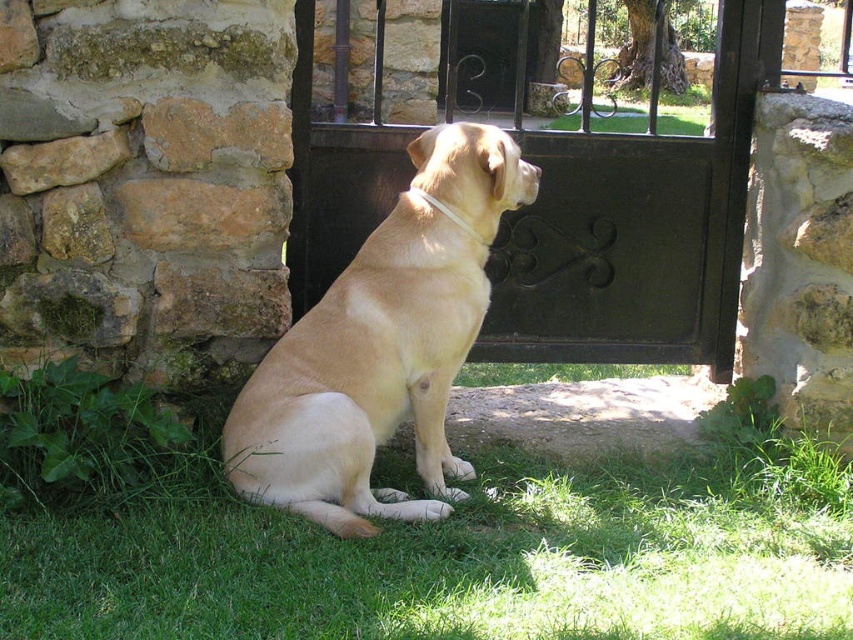
Question: Observing the image, what is the correct spatial positioning of green grass at lower center in reference to golden fur dog at center?

Choices:
 (A) below
 (B) above

Answer: (A)

Question: Which of the following is the farthest from the observer?

Choices:
 (A) golden fur dog at center
 (B) black wrought iron gate at center

Answer: (B)

Question: Is the position of black wrought iron gate at center less distant than that of golden fur dog at center?

Choices:
 (A) yes
 (B) no

Answer: (B)

Question: Which object is the farthest from the golden fur dog at center?

Choices:
 (A) green grass at lower center
 (B) black wrought iron gate at center

Answer: (B)

Question: Which point is closer to the camera?

Choices:
 (A) green grass at lower center
 (B) golden fur dog at center
 (C) black wrought iron gate at center

Answer: (A)

Question: Observing the image, what is the correct spatial positioning of black wrought iron gate at center in reference to golden fur dog at center?

Choices:
 (A) below
 (B) above

Answer: (B)